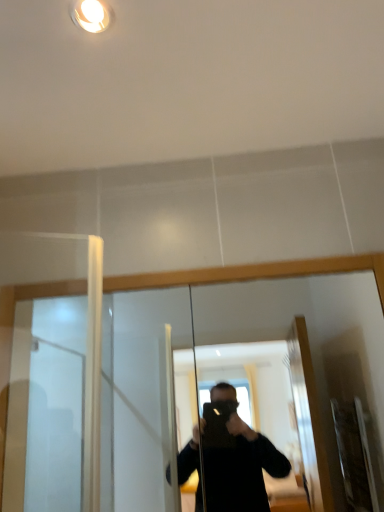
Describe the element at coordinates (91, 15) in the screenshot. The width and height of the screenshot is (384, 512). I see `white glossy light fixture at upper center` at that location.

The image size is (384, 512). In order to click on white glossy light fixture at upper center in this screenshot , I will do `click(91, 15)`.

Where is `white glossy light fixture at upper center`? The width and height of the screenshot is (384, 512). white glossy light fixture at upper center is located at coordinates (91, 15).